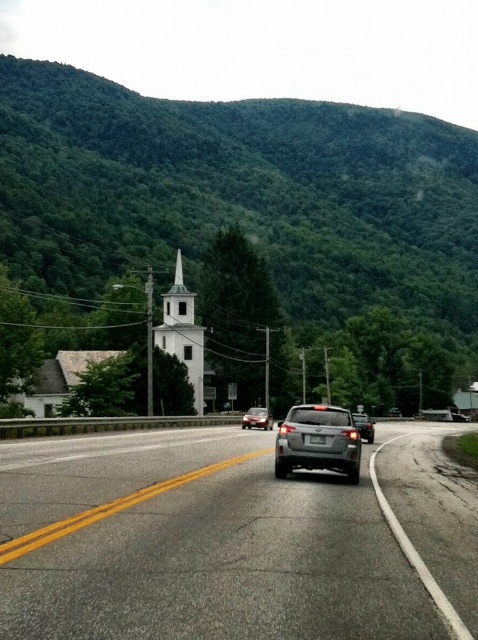
Question: Which point is closer to the camera?

Choices:
 (A) (270, 426)
 (B) (355, 426)
 (C) (334, 413)

Answer: (B)

Question: Is the position of green leafy mountain at upper center more distant than that of satin gray suv at center?

Choices:
 (A) no
 (B) yes

Answer: (B)

Question: Estimate the real-world distances between objects in this image. Which object is farther from the glossy black car at center?

Choices:
 (A) gray asphalt highway at center
 (B) satin gray suv at center
 (C) matte gray suv at center

Answer: (C)

Question: Does gray asphalt highway at center have a larger size compared to green leafy mountain at upper center?

Choices:
 (A) yes
 (B) no

Answer: (B)

Question: Is gray asphalt highway at center further to the viewer compared to matte gray suv at center?

Choices:
 (A) no
 (B) yes

Answer: (A)

Question: Which point is closer to the camera?

Choices:
 (A) matte gray suv at center
 (B) glossy black car at center

Answer: (B)